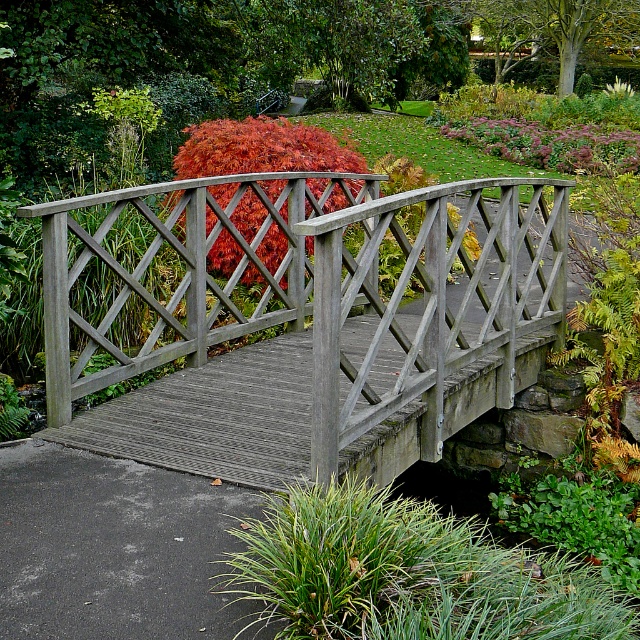
You are standing at the point with coordinates (317, 330) in the image of a garden with a wooden bridge. Is this point located on the wooden bridge at center?

Yes, the point (317, 330) is on the wooden bridge at center according to the description.

You are standing at point (x=413, y=336) and want to cross the bridge to reach the other side. The bridge is 23.04 feet long. If your stride length is 2.4 feet, how many steps will you need to take to cross the bridge?

The bridge is 23.04 feet long, and each step covers 2.4 feet. Dividing the total length by the stride length gives 23.04 divided by 2.4 equals 9.6, so you would need to take 10 steps to cross the bridge safely.